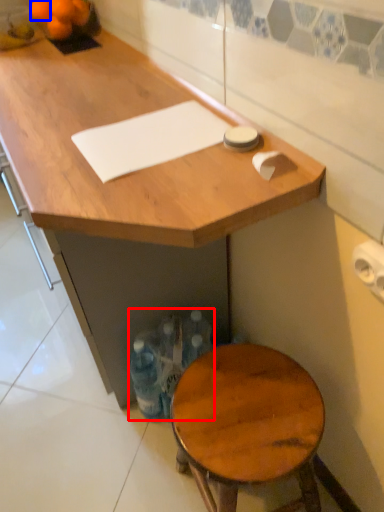
Question: Which of the following is the closest to the observer, bottle (highlighted by a red box) or orange (highlighted by a blue box)?

Choices:
 (A) bottle
 (B) orange

Answer: (A)